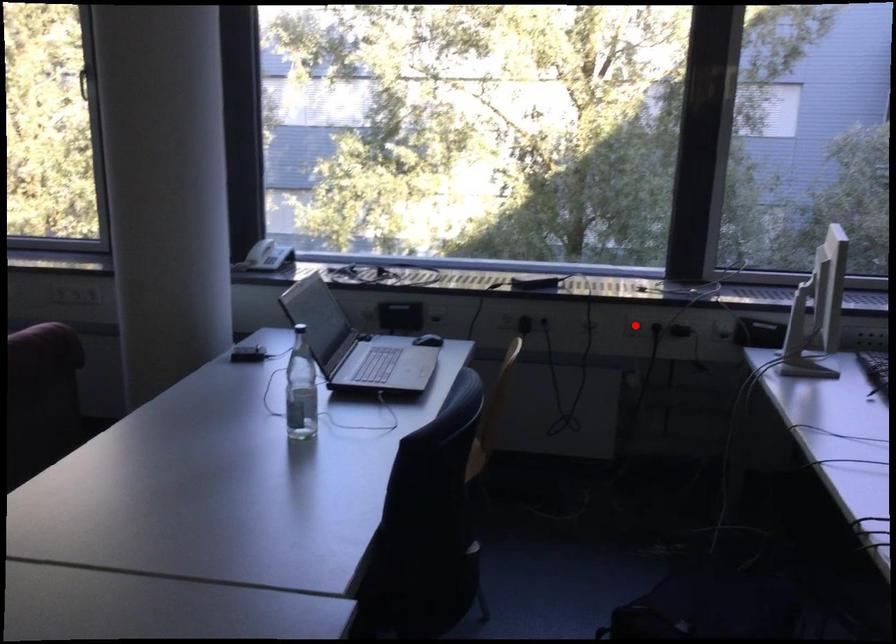
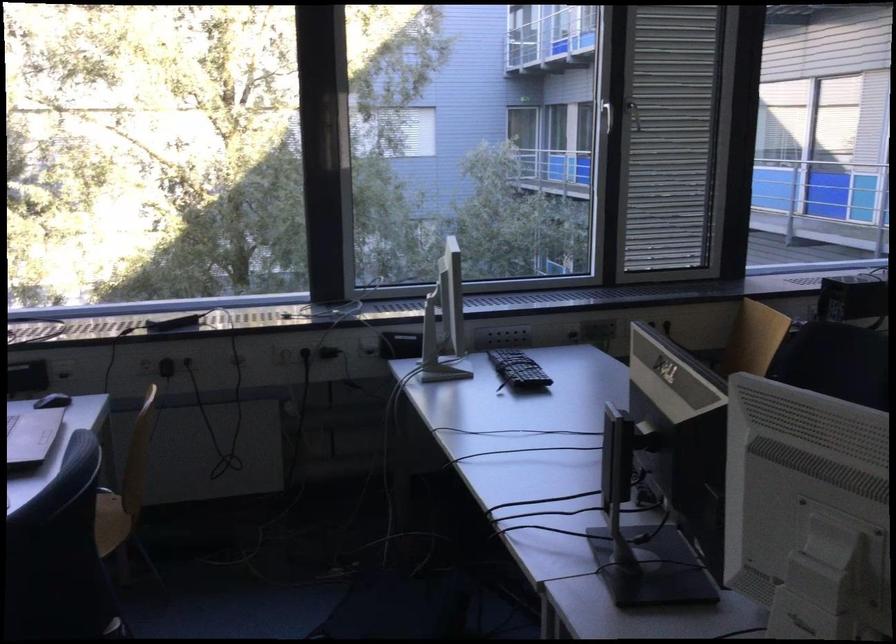
The point at the highlighted location is marked in the first image. Where is the corresponding point in the second image?

(285, 354)